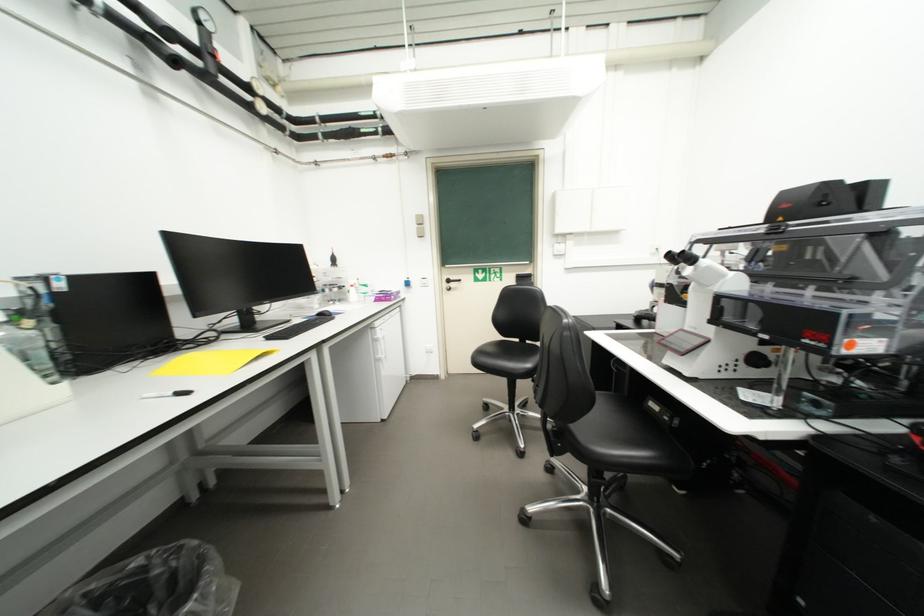
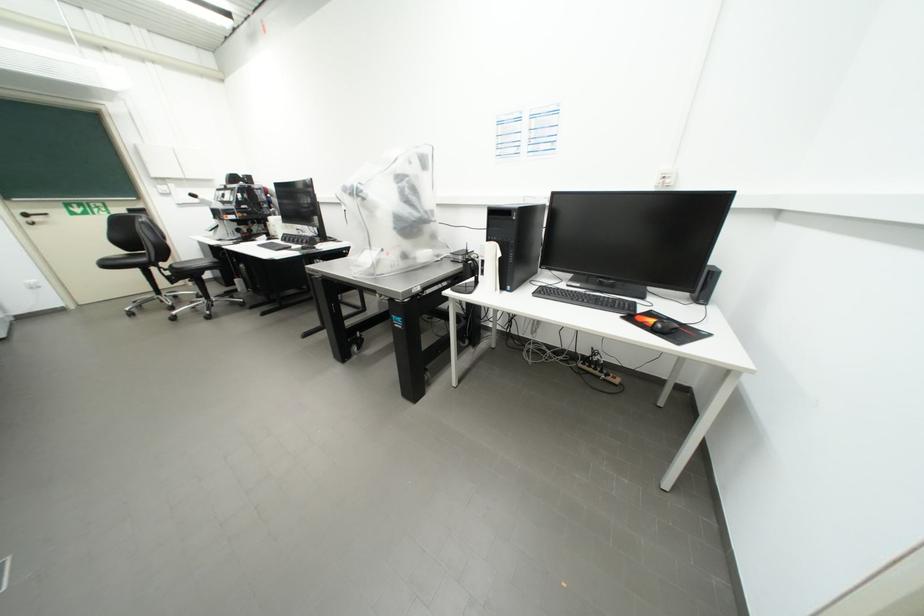
Locate, in the second image, the point that corresponds to [513,408] in the first image.

(160, 296)